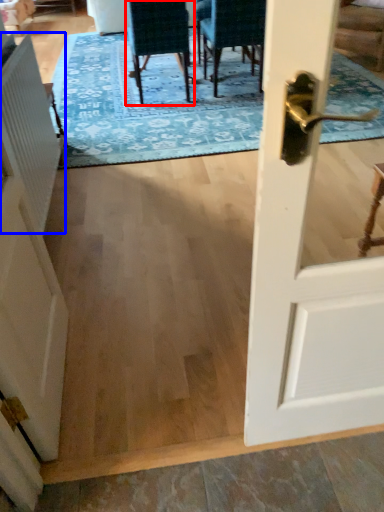
Question: Which point is further to the camera, chair (highlighted by a red box) or radiator (highlighted by a blue box)?

Choices:
 (A) chair
 (B) radiator

Answer: (A)